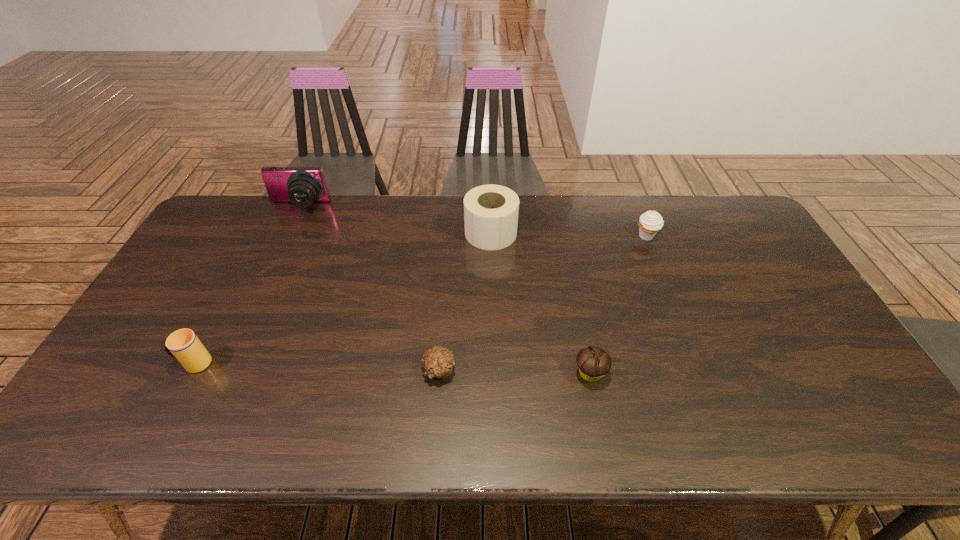
Where is `camera`? Image resolution: width=960 pixels, height=540 pixels. camera is located at coordinates (302, 186).

This screenshot has height=540, width=960. What are the coordinates of `the fourth object from left to right` in the screenshot? It's located at (491, 211).

Find the location of a particular element. The height and width of the screenshot is (540, 960). the rightmost object is located at coordinates (651, 222).

I want to click on the tallest muffin, so click(651, 222).

Where is `cup`? Image resolution: width=960 pixels, height=540 pixels. cup is located at coordinates (183, 345).

Locate an element on the screen. The image size is (960, 540). the second muffin from left to right is located at coordinates (593, 362).

Locate an element on the screen. The width and height of the screenshot is (960, 540). the second shortest object is located at coordinates (593, 362).

The height and width of the screenshot is (540, 960). In order to click on the leftmost muffin in this screenshot , I will do `click(438, 362)`.

The image size is (960, 540). What are the coordinates of `the shortest object` in the screenshot? It's located at (438, 362).

Find the location of `free space located on the front-facing side of the camera`. free space located on the front-facing side of the camera is located at coordinates (258, 292).